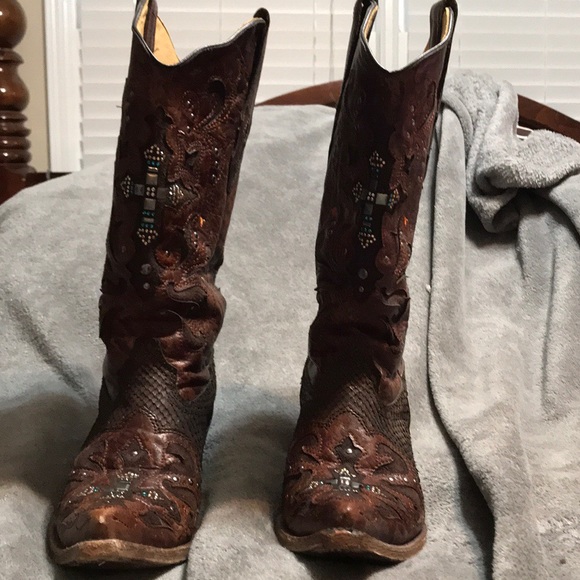
The width and height of the screenshot is (580, 580). I want to click on trim, so click(x=72, y=77).